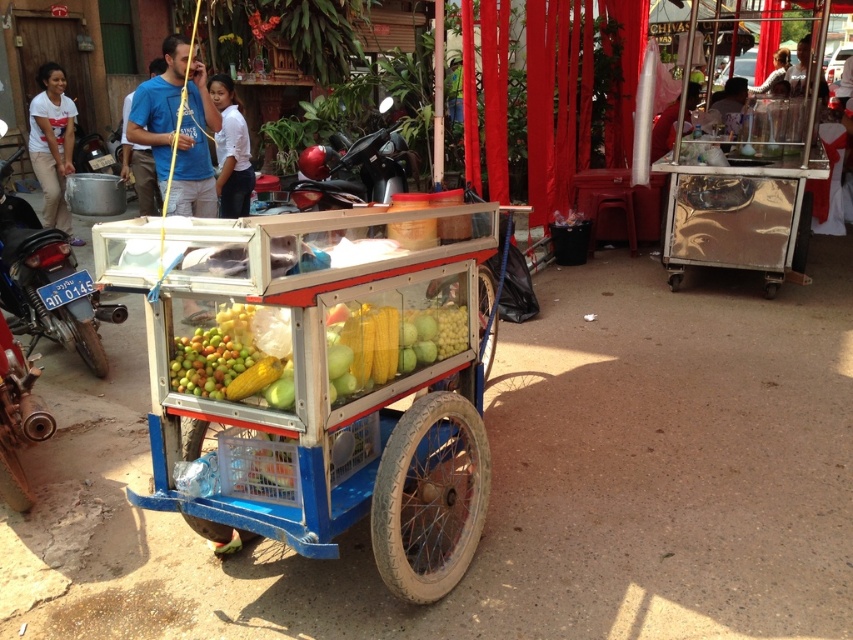
Question: Is green matte corn at center below brushed metal motorcycle at left?

Choices:
 (A) yes
 (B) no

Answer: (A)

Question: Among these points, which one is nearest to the camera?

Choices:
 (A) (428, 321)
 (B) (183, 419)

Answer: (B)

Question: Does shiny black motorcycle at center appear on the left side of white cotton shirt at upper left?

Choices:
 (A) no
 (B) yes

Answer: (A)

Question: Which of the following is the closest to the observer?

Choices:
 (A) (12, 259)
 (B) (64, 220)
 (C) (273, 320)

Answer: (C)

Question: Does brushed metal motorcycle at left appear on the right side of light brown hair at center?

Choices:
 (A) no
 (B) yes

Answer: (A)

Question: Which is nearer to the green matte corn at center?

Choices:
 (A) white cotton shirt at upper left
 (B) brushed metal motorcycle at left
 (C) light brown hair at center

Answer: (B)